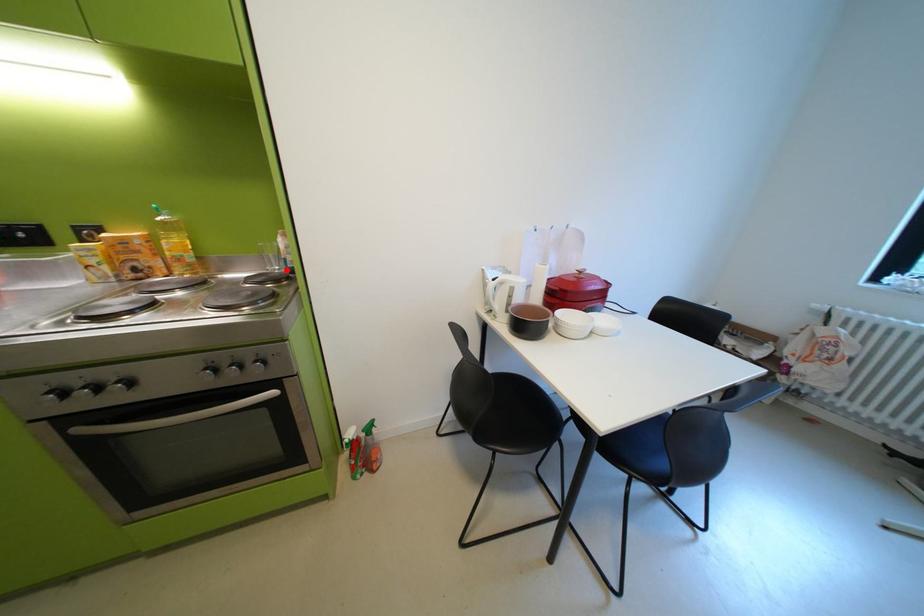
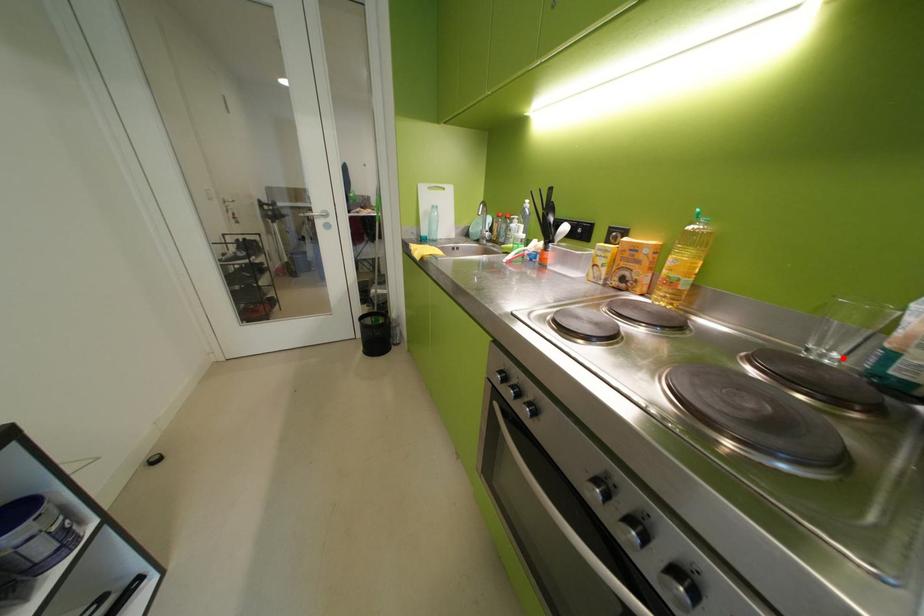
I am providing you with two images of the same scene from different viewpoints. A red point is marked on the first image and another point is marked on the second image. Do the highlighted points in image1 and image2 indicate the same real-world spot?

Yes